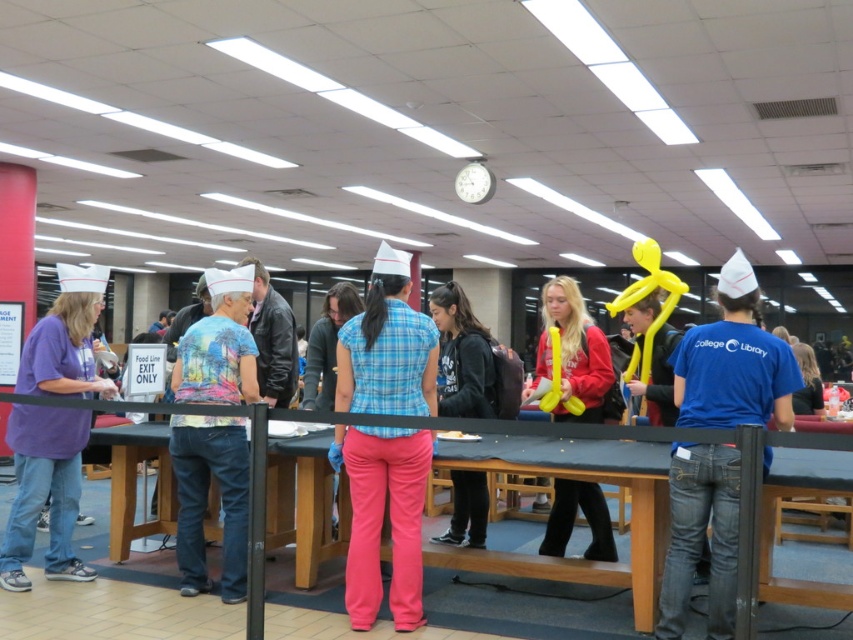
Who is more distant from viewer, (364, 371) or (38, 392)?

The point (38, 392) is behind.

Is plaid fabric shirt at center above matte purple shirt at left?

Actually, plaid fabric shirt at center is below matte purple shirt at left.

What do you see at coordinates (381, 518) in the screenshot? Image resolution: width=853 pixels, height=640 pixels. I see `plaid fabric shirt at center` at bounding box center [381, 518].

You are a GUI agent. You are given a task and a screenshot of the screen. Output one action in this format:
    pyautogui.click(x=<x>, y=<y>)
    Task: Click on the plaid fabric shirt at center
    
    Given the screenshot: What is the action you would take?
    pyautogui.click(x=381, y=518)

Between matte purple shirt at left and printed cotton shirt at center, which one is positioned lower?

Positioned lower is matte purple shirt at left.

Is point (67, 422) positioned before point (200, 419)?

No, (67, 422) is further to viewer.

Which is behind, point (41, 326) or point (184, 544)?

The point (41, 326) is more distant.

Where is `matte purple shirt at left`? This screenshot has width=853, height=640. matte purple shirt at left is located at coordinates (44, 490).

Is matte purple shirt at left to the right of white plastic clock at upper center from the viewer's perspective?

No, matte purple shirt at left is not to the right of white plastic clock at upper center.

Is matte purple shirt at left taller than white plastic clock at upper center?

Indeed, matte purple shirt at left has a greater height compared to white plastic clock at upper center.

Does point (45, 388) come behind point (479, 172)?

No, (45, 388) is closer to viewer.

At what (x,y) coordinates should I click in order to perform the action: click on matte purple shirt at left. Please return your answer as a coordinate pair (x, y). Looking at the image, I should click on (44, 490).